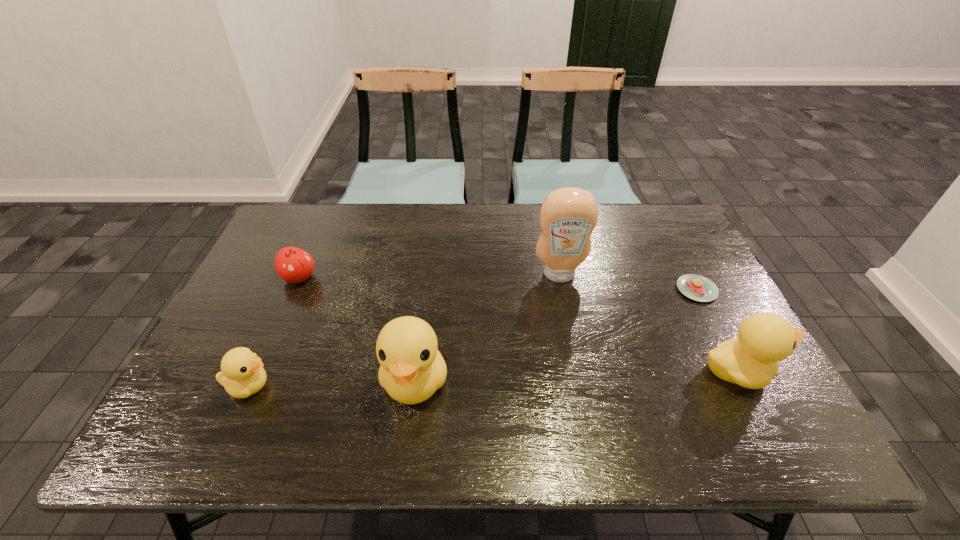
Find the location of a particular element. The width and height of the screenshot is (960, 540). vacant point located between the rightmost duck and the fourth object from right to left is located at coordinates coord(576,376).

Locate an element on the screen. Image resolution: width=960 pixels, height=540 pixels. vacant space that's between the tallest object and the shortest object is located at coordinates (628, 282).

You are a GUI agent. You are given a task and a screenshot of the screen. Output one action in this format:
    pyautogui.click(x=<x>, y=<y>)
    Task: Click on the vacant space that's between the fourth object from right to left and the shortest object
    The image size is (960, 540).
    Given the screenshot: What is the action you would take?
    pyautogui.click(x=556, y=335)

Identify the location of object that is the closest one to the leftmost duck. (411, 369).

Locate an element on the screen. object that is the third closest to the apple is located at coordinates (568, 216).

You are a GUI agent. You are given a task and a screenshot of the screen. Output one action in this format:
    pyautogui.click(x=<x>, y=<y>)
    Task: Click on the closest duck to the fourth object from right to left
    
    Given the screenshot: What is the action you would take?
    pyautogui.click(x=242, y=374)

What are the coordinates of `duck identified as the second closest to the rightmost duck` in the screenshot? It's located at (242, 374).

The width and height of the screenshot is (960, 540). Identify the location of free location that satisfies the following two spatial constraints: 1. on the label of the shortest object; 2. on the right side of the fourth object from left to right. (563, 290).

In order to click on free space that satisfies the following two spatial constraints: 1. on the label of the third object from right to left; 2. on the face of the shortest duck in this screenshot , I will do `click(581, 386)`.

Find the location of a particular element. This screenshot has height=540, width=960. blank area in the image that satisfies the following two spatial constraints: 1. on the label of the fourth object from left to right; 2. on the face of the leftmost duck is located at coordinates (581, 386).